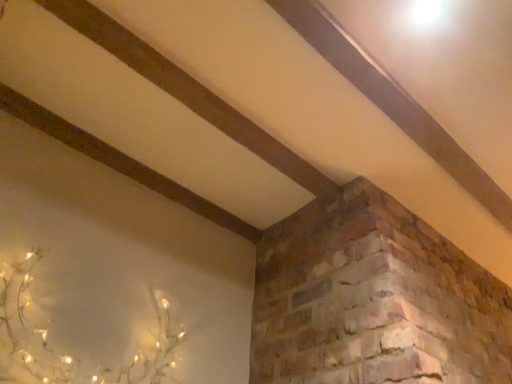
Question: Is ivory matte plant at lower left touching smooth wooden plank at upper center?

Choices:
 (A) yes
 (B) no

Answer: (B)

Question: Is ivory matte plant at lower left not inside smooth wooden plank at upper center?

Choices:
 (A) no
 (B) yes

Answer: (B)

Question: From a real-world perspective, is ivory matte plant at lower left below smooth wooden plank at upper center?

Choices:
 (A) no
 (B) yes

Answer: (B)

Question: Is the depth of ivory matte plant at lower left less than that of smooth wooden plank at upper center?

Choices:
 (A) no
 (B) yes

Answer: (B)

Question: From a real-world perspective, is ivory matte plant at lower left on smooth wooden plank at upper center?

Choices:
 (A) no
 (B) yes

Answer: (A)

Question: Is the depth of ivory matte plant at lower left greater than that of smooth wooden plank at upper center?

Choices:
 (A) yes
 (B) no

Answer: (B)

Question: Considering the relative sizes of smooth wooden plank at upper center and ivory matte plant at lower left in the image provided, is smooth wooden plank at upper center wider than ivory matte plant at lower left?

Choices:
 (A) yes
 (B) no

Answer: (B)

Question: Is smooth wooden plank at upper center to the right of ivory matte plant at lower left from the viewer's perspective?

Choices:
 (A) no
 (B) yes

Answer: (B)

Question: Is smooth wooden plank at upper center not close to ivory matte plant at lower left?

Choices:
 (A) no
 (B) yes

Answer: (B)

Question: Is smooth wooden plank at upper center positioned beyond the bounds of ivory matte plant at lower left?

Choices:
 (A) yes
 (B) no

Answer: (A)

Question: Is the depth of smooth wooden plank at upper center less than that of ivory matte plant at lower left?

Choices:
 (A) no
 (B) yes

Answer: (A)

Question: From the image's perspective, does smooth wooden plank at upper center appear higher than ivory matte plant at lower left?

Choices:
 (A) yes
 (B) no

Answer: (A)

Question: Is ivory matte plant at lower left bigger or smaller than smooth wooden plank at upper center?

Choices:
 (A) small
 (B) big

Answer: (B)